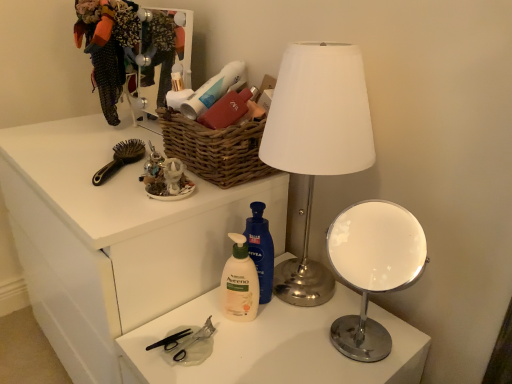
Locate an element on the screen. This screenshot has width=512, height=384. free area in between chrome/metallic table lamp at right and white matte lotion at center, which appears as the 2th cleaning product when viewed from the right is located at coordinates (297, 330).